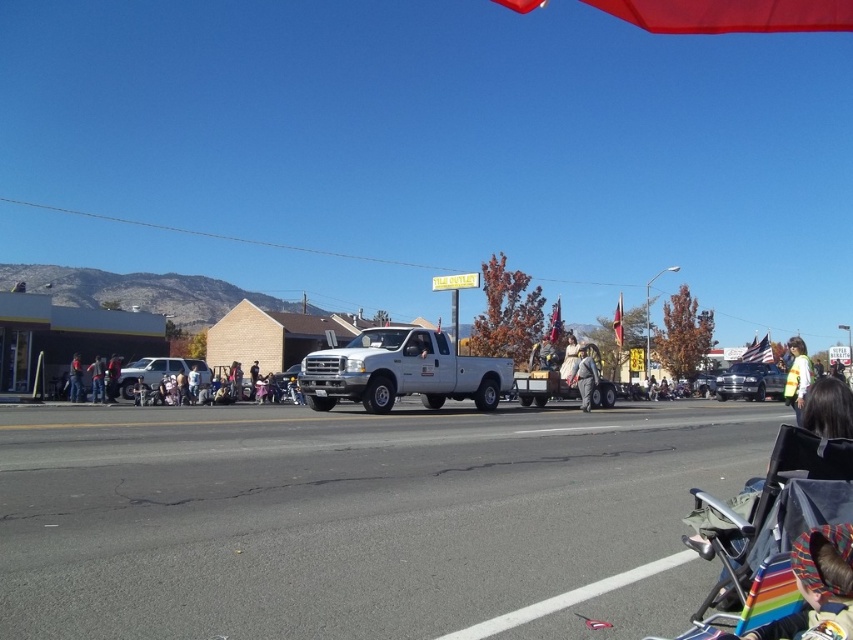
Question: Which object is positioned farthest from the dark gray jacket at lower left?

Choices:
 (A) gray fabric pants at center
 (B) denim jacket at center
 (C) red matte umbrella at upper center

Answer: (C)

Question: Is red matte umbrella at upper center above dark gray jacket at lower left?

Choices:
 (A) yes
 (B) no

Answer: (A)

Question: Where is dark gray jacket at lower left located in relation to dark gray jacket at left in the image?

Choices:
 (A) above
 (B) below

Answer: (B)

Question: Among these points, which one is farthest from the camera?

Choices:
 (A) (x=119, y=385)
 (B) (x=495, y=369)
 (C) (x=759, y=365)
 (D) (x=234, y=385)

Answer: (C)

Question: Is white matte truck at center closer to the viewer compared to red matte umbrella at upper center?

Choices:
 (A) no
 (B) yes

Answer: (A)

Question: Considering the real-world distances, which object is farthest from the dark gray jacket at left?

Choices:
 (A) plaid shirt at lower right
 (B) light blue denim jeans at lower left
 (C) dark blue jeans at lower left

Answer: (A)